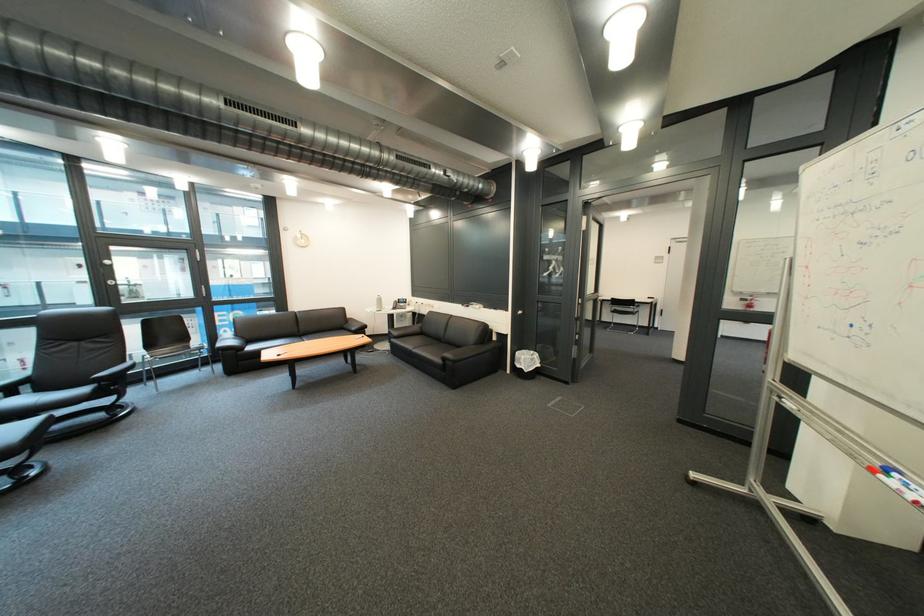
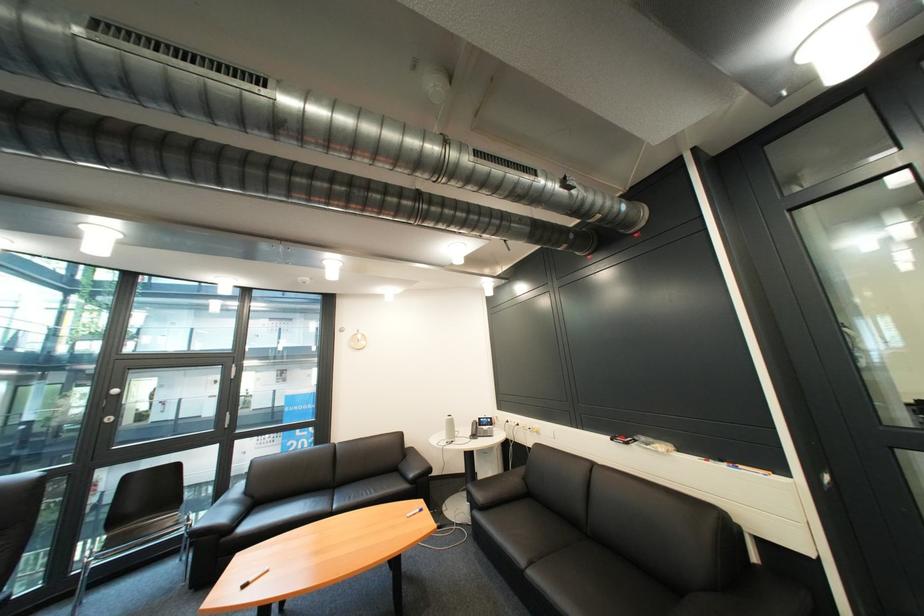
Locate, in the second image, the point that corresponds to point (444, 310) in the first image.

(549, 435)